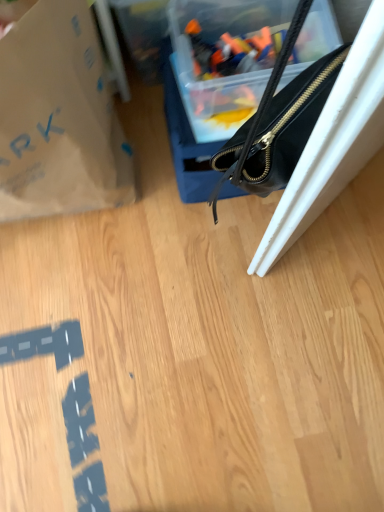
Describe the element at coordinates (58, 118) in the screenshot. The width and height of the screenshot is (384, 512). I see `brown paper bag at upper left` at that location.

At what (x,y) coordinates should I click in order to perform the action: click on brown paper bag at upper left. Please return your answer as a coordinate pair (x, y). The width and height of the screenshot is (384, 512). Looking at the image, I should click on (58, 118).

Where is `black leather handbag at upper right`? This screenshot has height=512, width=384. black leather handbag at upper right is located at coordinates (278, 122).

What do you see at coordinates (278, 122) in the screenshot? The image size is (384, 512). I see `black leather handbag at upper right` at bounding box center [278, 122].

Locate an element on the screen. brown paper bag at upper left is located at coordinates (58, 118).

Is brown paper bag at upper left to the left or to the right of black leather handbag at upper right in the image?

brown paper bag at upper left is to the left of black leather handbag at upper right.

Relative to black leather handbag at upper right, is brown paper bag at upper left in front or behind?

brown paper bag at upper left is in front of black leather handbag at upper right.

Which is in front, point (60, 71) or point (280, 150)?

Positioned in front is point (280, 150).

From the image's perspective, which is above, brown paper bag at upper left or black leather handbag at upper right?

black leather handbag at upper right appears higher in the image.

From a real-world perspective, which is physically below, brown paper bag at upper left or black leather handbag at upper right?

black leather handbag at upper right, from a real-world perspective.

Does brown paper bag at upper left have a lesser width compared to black leather handbag at upper right?

Yes.

Considering the sizes of objects brown paper bag at upper left and black leather handbag at upper right in the image provided, who is shorter, brown paper bag at upper left or black leather handbag at upper right?

black leather handbag at upper right.

Between brown paper bag at upper left and black leather handbag at upper right, which one has smaller size?

black leather handbag at upper right is smaller.

Is black leather handbag at upper right a part of brown paper bag at upper left?

No, brown paper bag at upper left does not contain black leather handbag at upper right.

Is brown paper bag at upper left far away from black leather handbag at upper right?

Actually, brown paper bag at upper left and black leather handbag at upper right are a little close together.

Is brown paper bag at upper left aimed at black leather handbag at upper right?

No.

You are a GUI agent. You are given a task and a screenshot of the screen. Output one action in this format:
    pyautogui.click(x=<x>, y=<y>)
    Task: Click on the handbag on the right of the brown paper bag at upper left
    The height and width of the screenshot is (512, 384).
    Given the screenshot: What is the action you would take?
    278,122

Which object is positioned more to the right, black leather handbag at upper right or brown paper bag at upper left?

black leather handbag at upper right is more to the right.

Is black leather handbag at upper right in front of or behind brown paper bag at upper left in the image?

Clearly, black leather handbag at upper right is behind brown paper bag at upper left.

Between point (296, 141) and point (96, 99), which one is positioned in front?

The point (296, 141) is more forward.

From the image's perspective, is black leather handbag at upper right under brown paper bag at upper left?

Actually, black leather handbag at upper right appears above brown paper bag at upper left in the image.

In the scene shown: From a real-world perspective, is black leather handbag at upper right physically above brown paper bag at upper left?

No, from a real-world perspective, black leather handbag at upper right is not over brown paper bag at upper left

Does black leather handbag at upper right have a lesser width compared to brown paper bag at upper left?

No, black leather handbag at upper right is not thinner than brown paper bag at upper left.

Does black leather handbag at upper right have a greater height compared to brown paper bag at upper left?

Incorrect, the height of black leather handbag at upper right is not larger of that of brown paper bag at upper left.

Considering the sizes of black leather handbag at upper right and brown paper bag at upper left in the image, is black leather handbag at upper right bigger or smaller than brown paper bag at upper left?

In the image, black leather handbag at upper right appears to be smaller than brown paper bag at upper left.

Is black leather handbag at upper right spatially inside brown paper bag at upper left, or outside of it?

black leather handbag at upper right lies outside brown paper bag at upper left.

Is black leather handbag at upper right not near brown paper bag at upper left?

No, black leather handbag at upper right is in close proximity to brown paper bag at upper left.

Is black leather handbag at upper right facing away from brown paper bag at upper left?

No, brown paper bag at upper left is not at the back of black leather handbag at upper right.

Based on the photo, what's the angular difference between black leather handbag at upper right and brown paper bag at upper left's facing directions?

0.904 degrees separate the facing orientations of black leather handbag at upper right and brown paper bag at upper left.

You are a GUI agent. You are given a task and a screenshot of the screen. Output one action in this format:
    pyautogui.click(x=<x>, y=<y>)
    Task: Click on the handbag above the brown paper bag at upper left (from the image's perspective)
    The height and width of the screenshot is (512, 384).
    Given the screenshot: What is the action you would take?
    pyautogui.click(x=278, y=122)

Locate an element on the screen. The height and width of the screenshot is (512, 384). handbag behind the brown paper bag at upper left is located at coordinates (278, 122).

At what (x,y) coordinates should I click in order to perform the action: click on tote bag above the black leather handbag at upper right (from a real-world perspective). Please return your answer as a coordinate pair (x, y). This screenshot has width=384, height=512. Looking at the image, I should click on (58, 118).